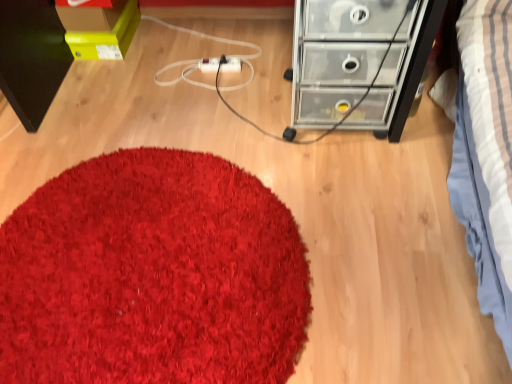
This screenshot has width=512, height=384. Find the location of `vacant space positioned to the left of transparent plastic chest of drawers at upper right`. vacant space positioned to the left of transparent plastic chest of drawers at upper right is located at coordinates (240, 100).